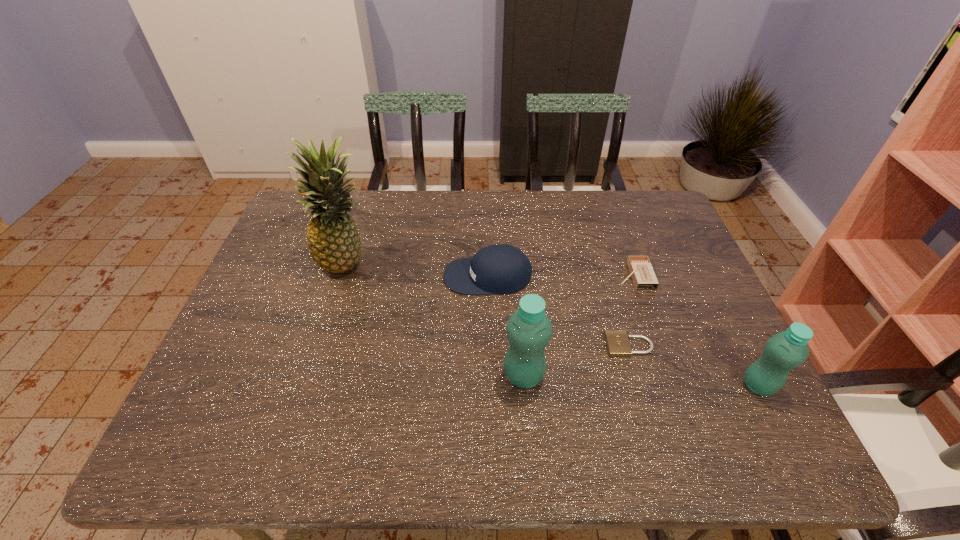
The height and width of the screenshot is (540, 960). What are the coordinates of `free region at the far right corner` in the screenshot? It's located at (661, 234).

This screenshot has height=540, width=960. I want to click on vacant space at the near right corner, so click(702, 395).

You are a GUI agent. You are given a task and a screenshot of the screen. Output one action in this format:
    pyautogui.click(x=<x>, y=<y>)
    Task: Click on the vacant area that lies between the fourth shortest object and the left water bottle
    The width and height of the screenshot is (960, 540).
    Given the screenshot: What is the action you would take?
    tap(641, 381)

Identify the location of empty space between the shorter water bottle and the fifth shortest object. The height and width of the screenshot is (540, 960). (641, 381).

Find the location of a particular element. free space between the taller water bottle and the baseball cap is located at coordinates (506, 326).

What are the coordinates of `free space between the shortest object and the fifth shortest object` in the screenshot? It's located at click(576, 361).

Image resolution: width=960 pixels, height=540 pixels. I want to click on free spot between the fifth tallest object and the shortest object, so click(632, 310).

Locate an element on the screen. The image size is (960, 540). blank region between the taller water bottle and the padlock is located at coordinates (576, 361).

What are the coordinates of `free point between the leftmost object and the fifth shortest object` in the screenshot? It's located at (436, 320).

The width and height of the screenshot is (960, 540). Identify the location of the third closest object to the fourth tallest object. (617, 342).